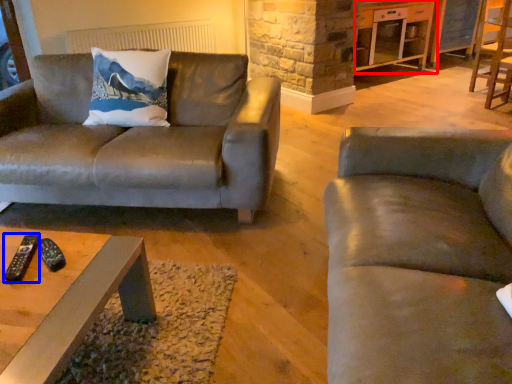
Question: Which point is closer to the camera, entertainment center (highlighted by a red box) or remote (highlighted by a blue box)?

Choices:
 (A) entertainment center
 (B) remote

Answer: (B)